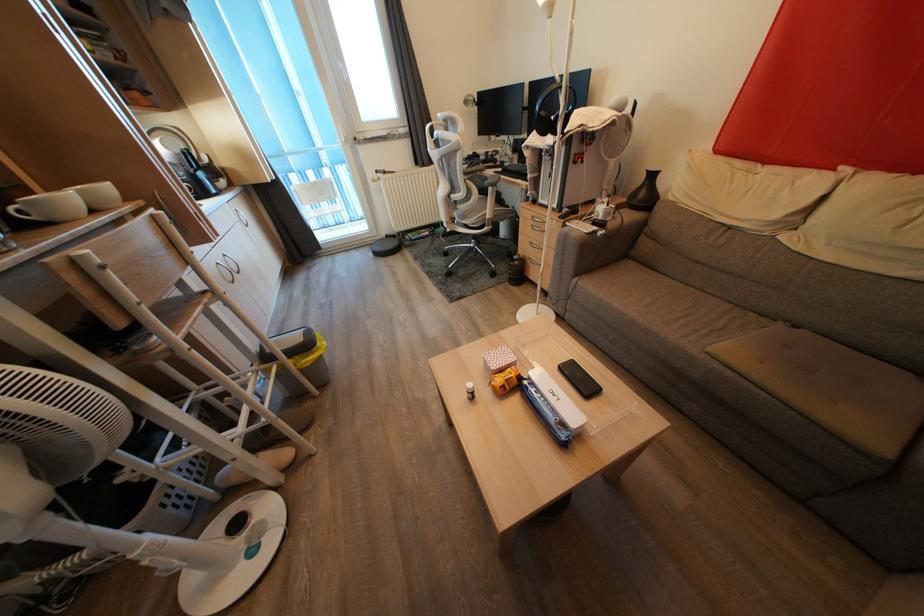
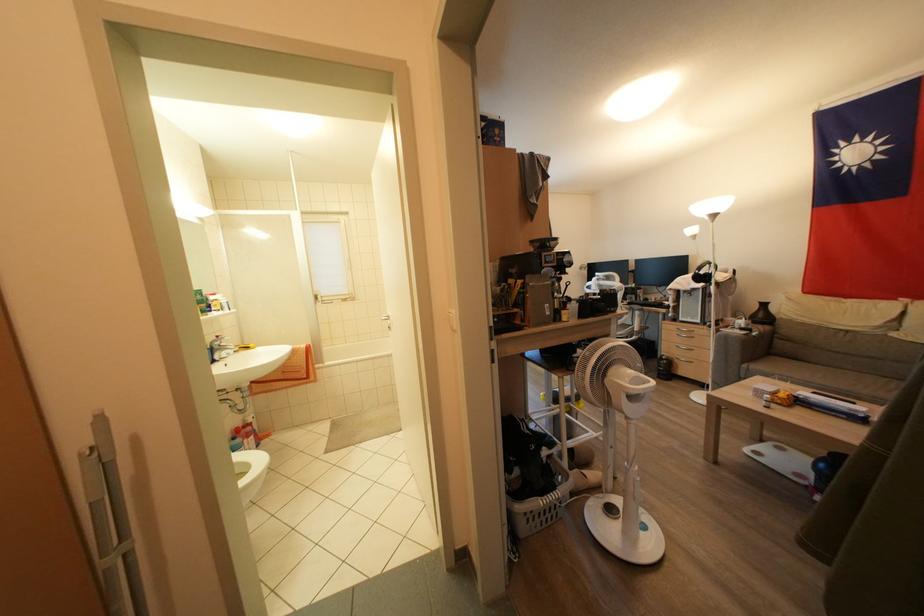
Locate, in the second image, the point that corresponds to point (600, 227) in the first image.

(747, 333)